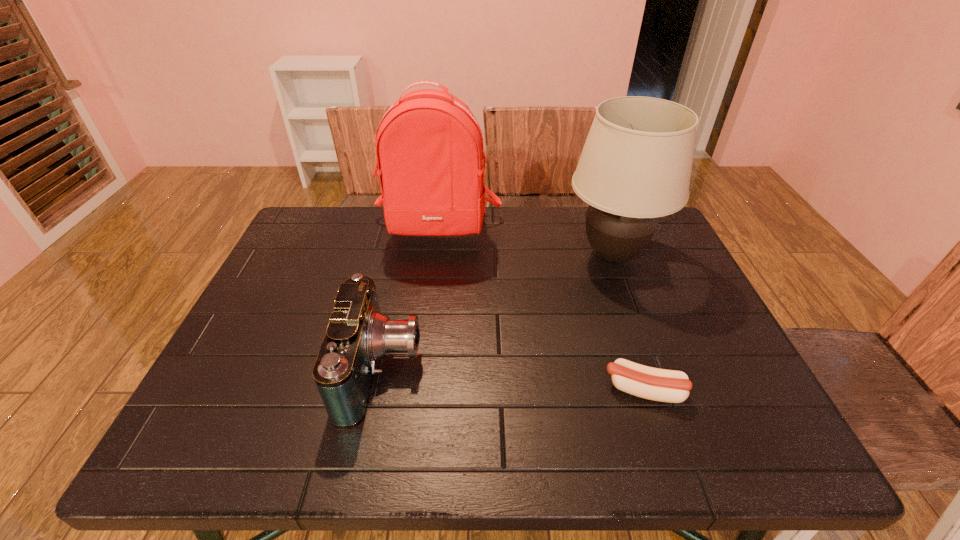
Identify which object is the nearest to the backpack. Please provide its 2D coordinates. Your answer should be formatted as a tuple, i.e. [(x, y)], where the tuple contains the x and y coordinates of a point satisfying the conditions above.

[(635, 166)]

The image size is (960, 540). I want to click on free spot that satisfies the following two spatial constraints: 1. on the front-facing side of the second shortest object; 2. on the right side of the sausage, so click(x=378, y=390).

Where is `vacant area that satisfies the following two spatial constraints: 1. on the front-facing side of the camcorder; 2. on the right side of the sausage`? This screenshot has width=960, height=540. vacant area that satisfies the following two spatial constraints: 1. on the front-facing side of the camcorder; 2. on the right side of the sausage is located at coordinates (378, 390).

The width and height of the screenshot is (960, 540). In order to click on vacant region that satisfies the following two spatial constraints: 1. on the main compartment of the backpack; 2. on the right side of the lampshade in this screenshot , I will do `click(435, 255)`.

Where is `free point that satisfies the following two spatial constraints: 1. on the main compartment of the shortest object; 2. on the right side of the backpack`? free point that satisfies the following two spatial constraints: 1. on the main compartment of the shortest object; 2. on the right side of the backpack is located at coordinates (418, 390).